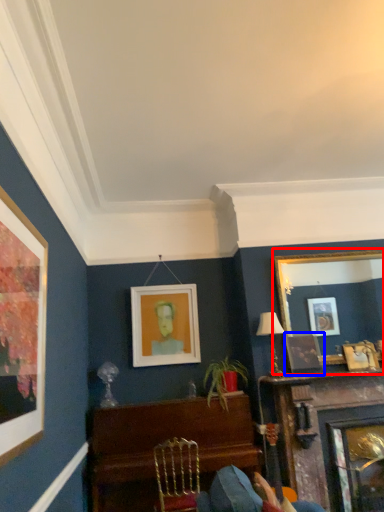
Question: Which point is closer to the camera, picture frame (highlighted by a red box) or picture frame (highlighted by a blue box)?

Choices:
 (A) picture frame
 (B) picture frame

Answer: (B)